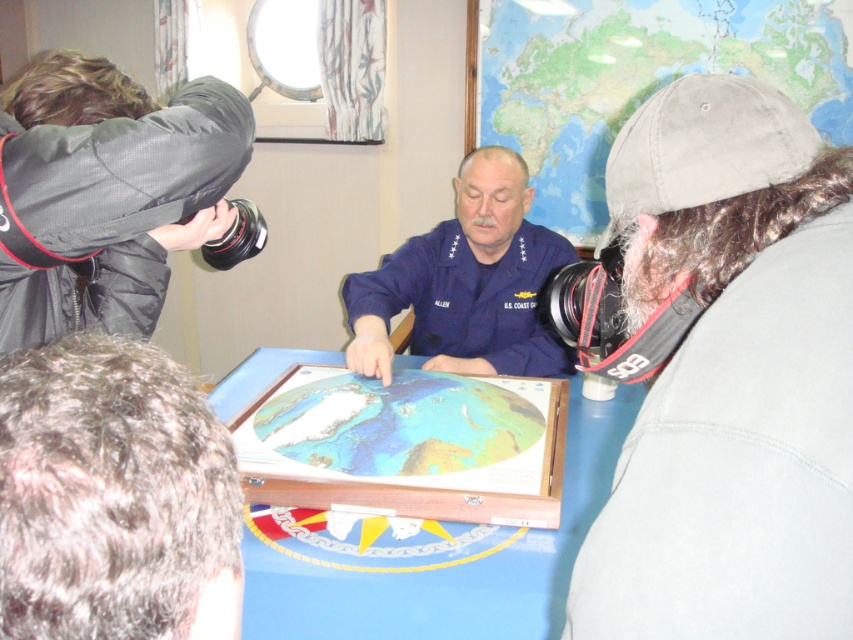
Question: Among these objects, which one is farthest from the camera?

Choices:
 (A) navy blue uniform at center
 (B) dark brown hair at lower left

Answer: (A)

Question: Does wooden map case at center have a smaller size compared to light blue paper map at center?

Choices:
 (A) no
 (B) yes

Answer: (A)

Question: Which point appears closest to the camera in this image?

Choices:
 (A) (231, 561)
 (B) (730, 294)

Answer: (A)

Question: Where is black fabric camera at left located in relation to wooden map case at center in the image?

Choices:
 (A) below
 (B) above

Answer: (B)

Question: Among these points, which one is nearest to the camera?

Choices:
 (A) (281, 458)
 (B) (253, 589)
 (C) (505, 259)
 (D) (16, 144)

Answer: (D)

Question: Can you confirm if dark brown hair at lower left is positioned to the right of light blue paper map at center?

Choices:
 (A) yes
 (B) no

Answer: (B)